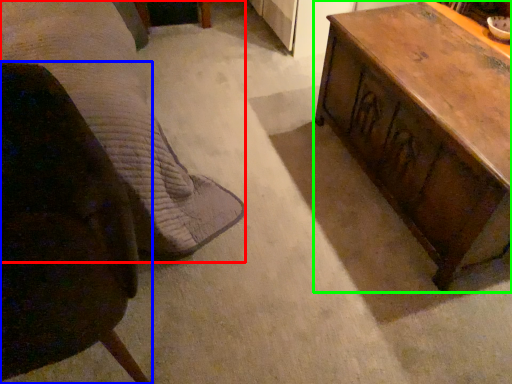
Question: Which object is the farthest from bed (highlighted by a red box)? Choose among these: chair (highlighted by a blue box) or table (highlighted by a green box).

Choices:
 (A) chair
 (B) table

Answer: (B)